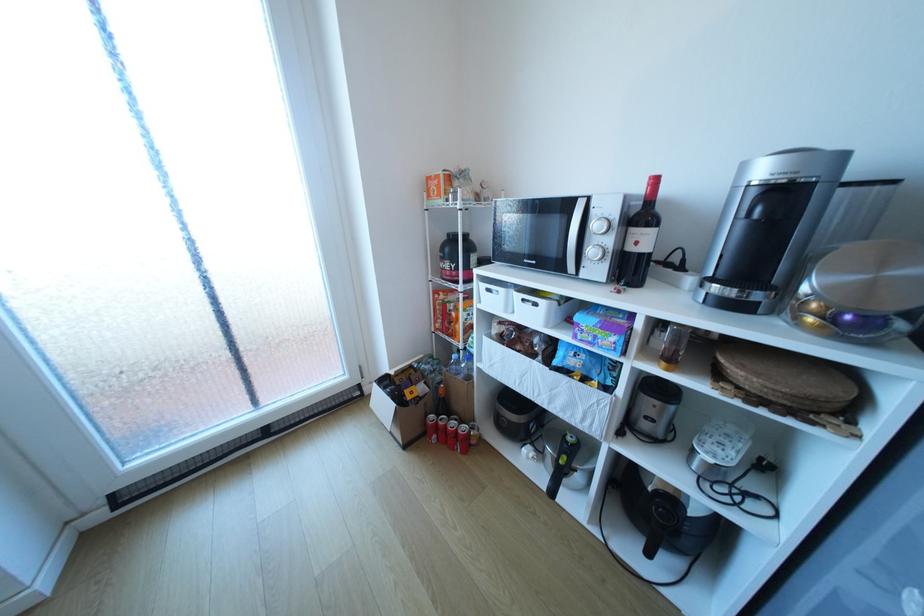
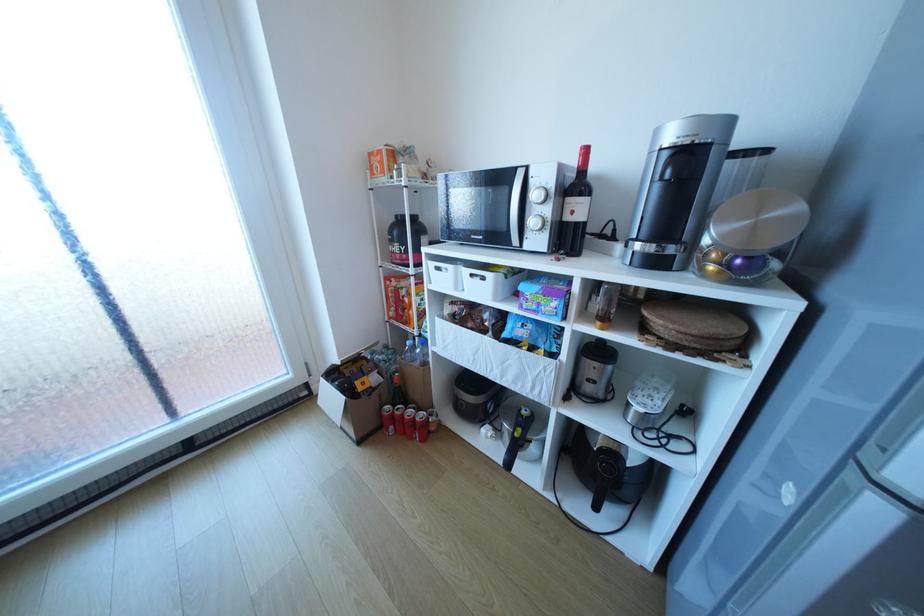
Where in the second image is the point corresponding to (435,415) from the first image?

(391, 407)